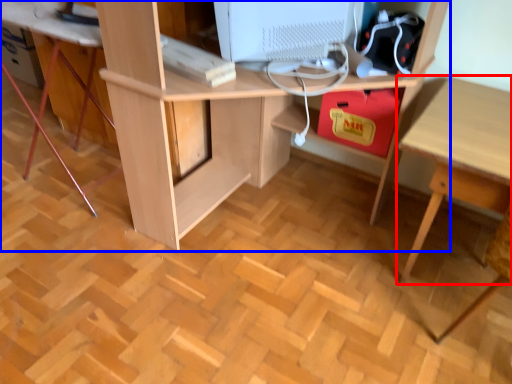
Question: Among these objects, which one is nearest to the camera, table (highlighted by a red box) or desk (highlighted by a blue box)?

Choices:
 (A) table
 (B) desk

Answer: (B)